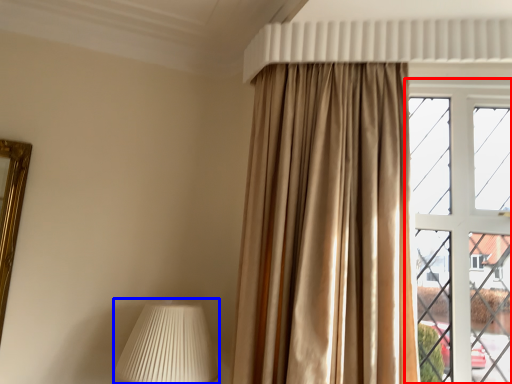
Question: Among these objects, which one is nearest to the camera, window (highlighted by a red box) or table lamp (highlighted by a blue box)?

Choices:
 (A) window
 (B) table lamp

Answer: (B)